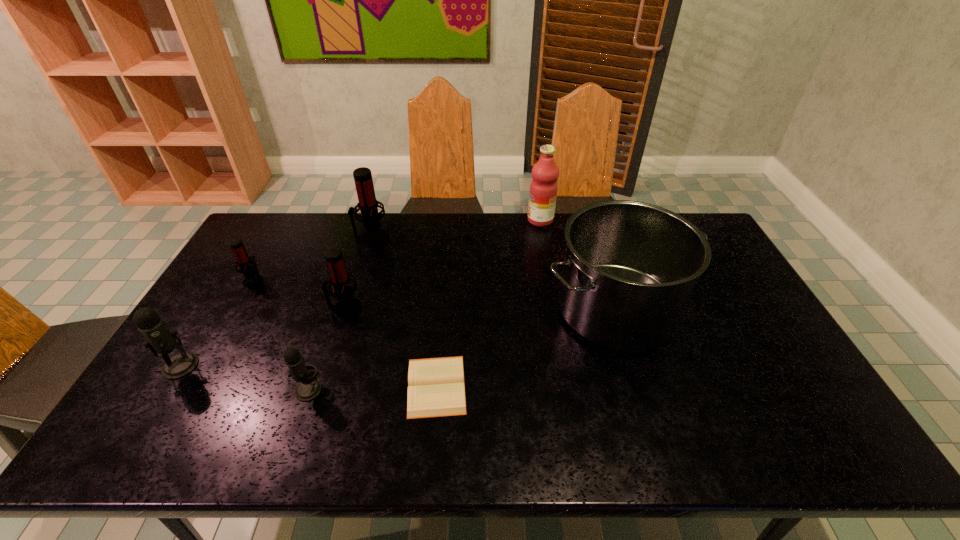
Locate an element on the screen. The image size is (960, 540). free space located 0.130m on the right of the smallest red microphone is located at coordinates (303, 280).

Image resolution: width=960 pixels, height=540 pixels. I want to click on blank space located on the back of the smaller black microphone, so click(336, 307).

Identify the location of vacant space situated 0.330m on the left of the sixth object from left to right. (276, 386).

In order to click on fruit juice that is positioned at the far edge in this screenshot , I will do `click(543, 189)`.

Image resolution: width=960 pixels, height=540 pixels. What are the coordinates of `microphone at the far edge` in the screenshot? It's located at (374, 236).

This screenshot has width=960, height=540. I want to click on free space at the far edge of the desktop, so click(526, 247).

Identify the location of free spot at the near edge of the desktop. (471, 421).

Locate an element on the screen. vacant space at the left edge is located at coordinates (200, 348).

Where is `vacant space at the right edge of the desktop`? The image size is (960, 540). vacant space at the right edge of the desktop is located at coordinates (702, 305).

In the image, there is a desktop. At what (x,y) coordinates should I click in order to perform the action: click on free space at the near left corner. Please return your answer as a coordinate pair (x, y). The width and height of the screenshot is (960, 540). Looking at the image, I should click on (130, 423).